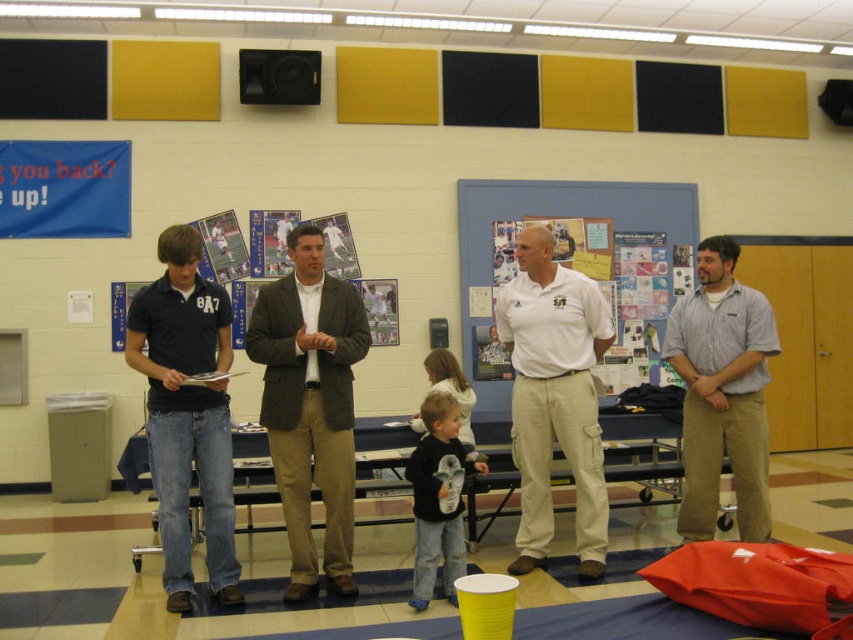
Question: Can you confirm if brown textured blazer at center is thinner than dark blue cotton polo shirt at left?

Choices:
 (A) no
 (B) yes

Answer: (A)

Question: Among these points, which one is farthest from the camera?

Choices:
 (A) (434, 429)
 (B) (273, 426)
 (C) (759, 465)
 (D) (581, 547)

Answer: (C)

Question: Is brown textured blazer at center to the left of black cotton shirt at center from the viewer's perspective?

Choices:
 (A) yes
 (B) no

Answer: (A)

Question: Can you confirm if blue matte bulletin board at center is positioned above black cotton shirt at center?

Choices:
 (A) yes
 (B) no

Answer: (A)

Question: Among these points, which one is farthest from the camera?

Choices:
 (A) (474, 218)
 (B) (314, 580)
 (C) (422, 529)

Answer: (A)

Question: Which object is closer to the camera taking this photo?

Choices:
 (A) white cotton shirt at center
 (B) blue matte bulletin board at center
 (C) dark blue cotton polo shirt at left
 (D) gray cotton shirt at right

Answer: (C)